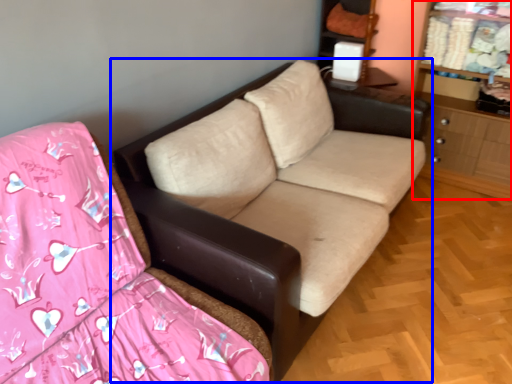
Question: Which of the following is the closest to the observer, dresser (highlighted by a red box) or studio couch (highlighted by a blue box)?

Choices:
 (A) dresser
 (B) studio couch

Answer: (B)